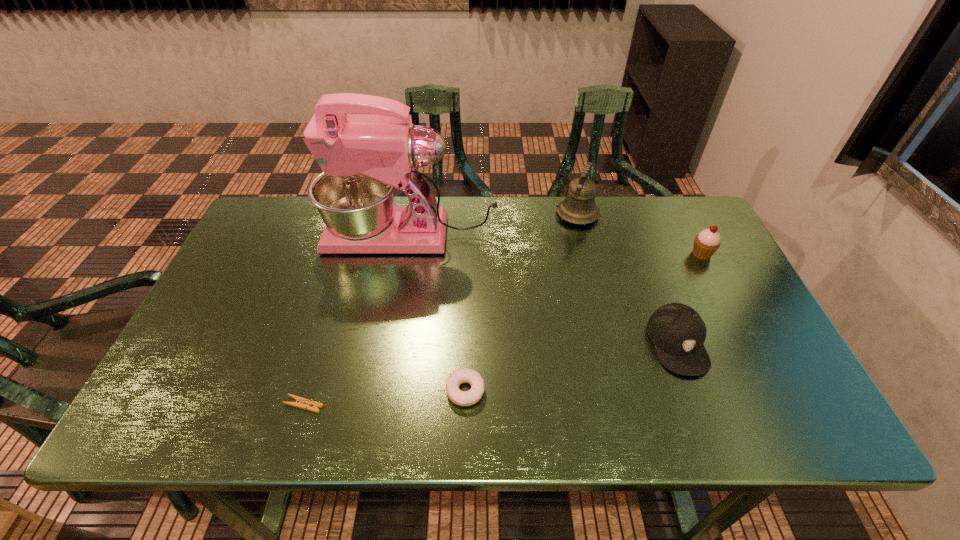
Image resolution: width=960 pixels, height=540 pixels. Find the location of `blank area in the image that satisfies the following two spatial constraints: 1. on the face of the tallest object; 2. on the front side of the clothespin`. blank area in the image that satisfies the following two spatial constraints: 1. on the face of the tallest object; 2. on the front side of the clothespin is located at coordinates (384, 405).

Identify the location of vacant space that satisfies the following two spatial constraints: 1. on the face of the doughnut; 2. on the left side of the tallest object. This screenshot has height=540, width=960. (386, 391).

I want to click on blank area in the image that satisfies the following two spatial constraints: 1. on the face of the cupcake; 2. on the left side of the mixer, so click(x=409, y=254).

You are a GUI agent. You are given a task and a screenshot of the screen. Output one action in this format:
    pyautogui.click(x=<x>, y=<y>)
    Task: Click on the vacant space that satisfies the following two spatial constraints: 1. on the face of the tallest object; 2. on the front side of the clothespin
    This screenshot has width=960, height=540.
    Given the screenshot: What is the action you would take?
    pyautogui.click(x=384, y=405)